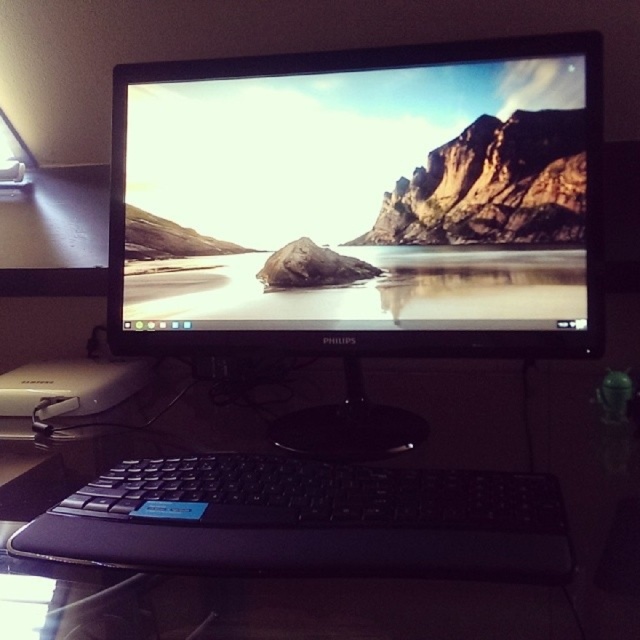
Question: Which point is closer to the camera?

Choices:
 (A) (317, 301)
 (B) (454, 572)

Answer: (B)

Question: Is black plastic keyboard at lower center positioned before black plastic keyboard at center?

Choices:
 (A) no
 (B) yes

Answer: (B)

Question: Which point is farther from the camera taking this photo?

Choices:
 (A) (284, 116)
 (B) (147, 445)

Answer: (A)

Question: Does black glossy monitor at center appear over black plastic keyboard at lower center?

Choices:
 (A) yes
 (B) no

Answer: (A)

Question: Which of these objects is positioned farthest from the black plastic keyboard at center?

Choices:
 (A) black glossy monitor at center
 (B) black plastic keyboard at lower center

Answer: (A)

Question: Can you confirm if black glossy monitor at center is positioned to the right of black plastic keyboard at center?

Choices:
 (A) no
 (B) yes

Answer: (B)